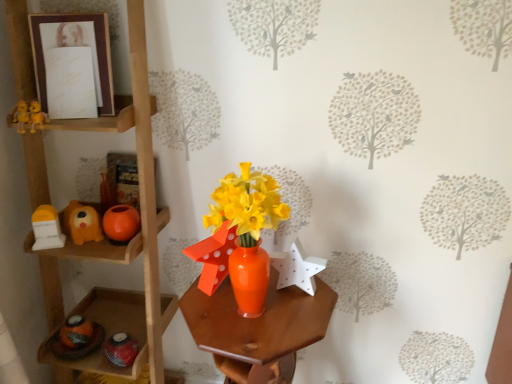
The height and width of the screenshot is (384, 512). In order to click on vacant area that is in front of white matte star at center, the first toy viewed from the right in this screenshot , I will do `click(288, 321)`.